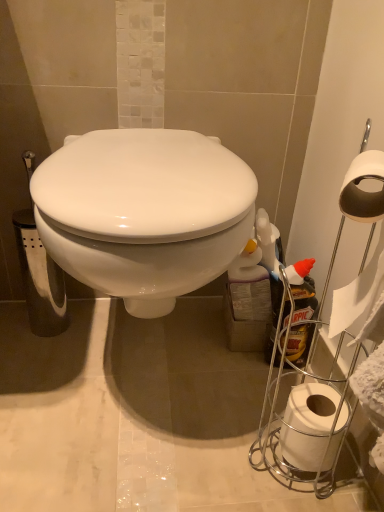
Image resolution: width=384 pixels, height=512 pixels. What do you see at coordinates (308, 424) in the screenshot?
I see `white paper at right` at bounding box center [308, 424].

You are a GUI agent. You are given a task and a screenshot of the screen. Output one action in this format:
    pyautogui.click(x=<x>, y=<y>)
    Task: Click on the white paper at right
    This screenshot has width=384, height=512.
    Given the screenshot: What is the action you would take?
    pyautogui.click(x=308, y=424)

What do you see at coordinates (301, 312) in the screenshot?
I see `white plastic spray bottle at right` at bounding box center [301, 312].

Find the location of a particular element. The height and width of the screenshot is (512, 384). white plastic spray bottle at right is located at coordinates (301, 312).

You are a GUI agent. You are given a task and a screenshot of the screen. Output one action in this format:
    pyautogui.click(x=<x>, y=<y>)
    Task: Click on the white paper at right
    
    Given the screenshot: What is the action you would take?
    pyautogui.click(x=308, y=424)

Consider the image. Between white paper at right and white plastic spray bottle at right, which one appears on the right side from the viewer's perspective?

white plastic spray bottle at right.

Is white paper at right positioned before white plastic spray bottle at right?

Yes, the depth of white paper at right is less than that of white plastic spray bottle at right.

Is point (336, 401) positioned behind point (314, 295)?

That is False.

From the image's perspective, between white paper at right and white plastic spray bottle at right, which one is located above?

white plastic spray bottle at right appears higher in the image.

From a real-world perspective, is white paper at right on top of white plastic spray bottle at right?

Actually, white paper at right is physically below white plastic spray bottle at right in the real world.

In the scene shown: Considering the sizes of objects white paper at right and white plastic spray bottle at right in the image provided, who is thinner, white paper at right or white plastic spray bottle at right?

white plastic spray bottle at right is thinner.

Can you confirm if white paper at right is shorter than white plastic spray bottle at right?

Correct, white paper at right is not as tall as white plastic spray bottle at right.

Considering the sizes of objects white paper at right and white plastic spray bottle at right in the image provided, who is smaller, white paper at right or white plastic spray bottle at right?

Smaller between the two is white paper at right.

Is white paper at right positioned beyond the bounds of white plastic spray bottle at right?

Yes, white paper at right is not within white plastic spray bottle at right.

Is white paper at right positioned far away from white plastic spray bottle at right?

They are positioned close to each other.

Is white paper at right aimed at white plastic spray bottle at right?

No.

The image size is (384, 512). What are the coordinates of `cleaning product above the white paper at right (from a real-world perspective)` in the screenshot? It's located at click(301, 312).

Can you confirm if white plastic spray bottle at right is positioned to the right of white paper at right?

Yes, white plastic spray bottle at right is to the right of white paper at right.

Relative to white paper at right, is white plastic spray bottle at right in front or behind?

white plastic spray bottle at right is behind white paper at right.

Is point (301, 303) closer to viewer compared to point (292, 403)?

That is False.

From the image's perspective, which one is positioned higher, white plastic spray bottle at right or white paper at right?

white plastic spray bottle at right.

From a real-world perspective, does white plastic spray bottle at right stand above white paper at right?

Yes, from a real-world perspective, white plastic spray bottle at right is over white paper at right

In terms of width, does white plastic spray bottle at right look wider or thinner when compared to white paper at right?

Considering their sizes, white plastic spray bottle at right looks slimmer than white paper at right.

Considering the sizes of objects white plastic spray bottle at right and white paper at right in the image provided, who is shorter, white plastic spray bottle at right or white paper at right?

With less height is white paper at right.

Considering the sizes of objects white plastic spray bottle at right and white paper at right in the image provided, who is bigger, white plastic spray bottle at right or white paper at right?

Bigger between the two is white plastic spray bottle at right.

Is white plastic spray bottle at right not inside white paper at right?

Absolutely, white plastic spray bottle at right is external to white paper at right.

Is white plastic spray bottle at right with white paper at right?

white plastic spray bottle at right and white paper at right are clearly separated.

Is white plastic spray bottle at right turned away from white paper at right?

white plastic spray bottle at right does not have its back to white paper at right.

How many degrees apart are the facing directions of white plastic spray bottle at right and white paper at right?

They differ by 87.1 degrees in their facing directions.

Locate an element on the screen. cleaning product behind the white paper at right is located at coordinates (301, 312).

In order to click on cleaning product that is behind the white paper at right in this screenshot , I will do `click(301, 312)`.

Where is `toilet paper that is below the white plastic spray bottle at right (from the image's perspective)`? toilet paper that is below the white plastic spray bottle at right (from the image's perspective) is located at coordinates (308, 424).